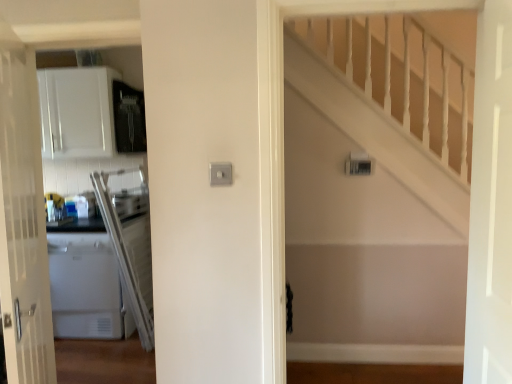
Question: Looking at the image, does white glossy door at right, arranged as the first door when viewed from the right, seem bigger or smaller compared to white glossy door at left, which is the 1th door from left to right?

Choices:
 (A) big
 (B) small

Answer: (B)

Question: Is white glossy door at right, the 2th door positioned from the left, inside or outside of white glossy door at left, which appears as the second door when viewed from the right?

Choices:
 (A) inside
 (B) outside

Answer: (B)

Question: Considering the real-world distances, which object is closest to the white glossy door at left, which appears as the second door when viewed from the right?

Choices:
 (A) white wooden staircase at upper right
 (B) white glossy door at right, arranged as the first door when viewed from the right

Answer: (B)

Question: Which object is positioned farthest from the white glossy door at right, arranged as the first door when viewed from the right?

Choices:
 (A) white glossy door at left, which appears as the second door when viewed from the right
 (B) white wooden staircase at upper right

Answer: (A)